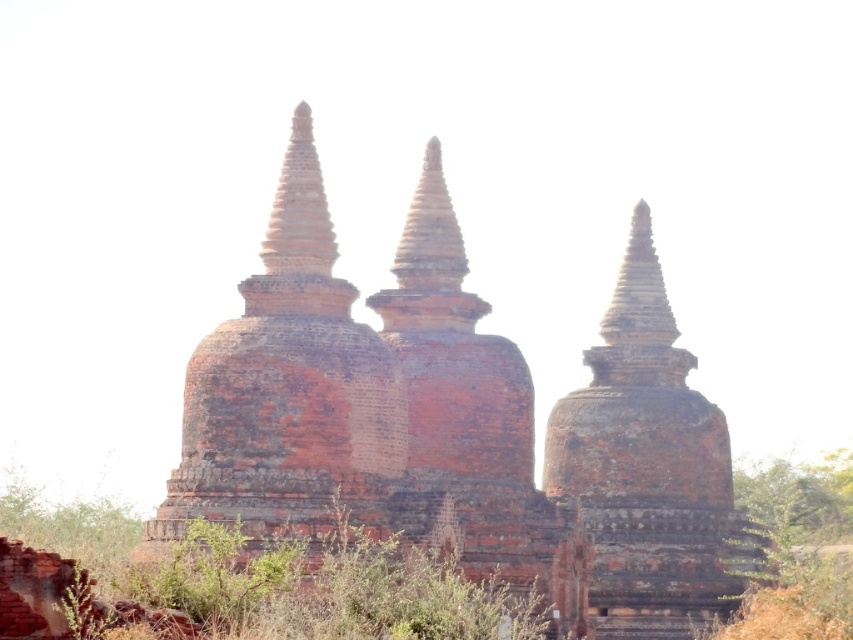
You are standing in front of a cluster of ancient brick stupas. You notice a point marked at coordinates (564, 444). Which object does this point correspond to?

The point at coordinates (564, 444) corresponds to the reddish brown brick pagoda at center.